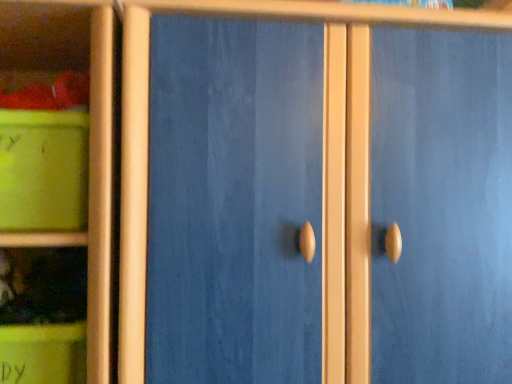
What do you see at coordinates (42, 170) in the screenshot? I see `matte green plastic container at left` at bounding box center [42, 170].

Locate an element on the screen. The height and width of the screenshot is (384, 512). matte green plastic container at left is located at coordinates (42, 170).

Measure the distance between point (56, 199) and camera.

They are 28.70 inches apart.

Identify the location of green matte container at lower left. (42, 315).

Describe the element at coordinates (42, 315) in the screenshot. I see `green matte container at lower left` at that location.

Identify the location of matte green plastic container at left. The image size is (512, 384). (42, 170).

Between green matte container at lower left and matte green plastic container at left, which one appears on the right side from the viewer's perspective?

From the viewer's perspective, green matte container at lower left appears more on the right side.

Considering the relative positions of green matte container at lower left and matte green plastic container at left in the image provided, is green matte container at lower left behind matte green plastic container at left?

That is True.

Considering the positions of points (26, 253) and (9, 197), is point (26, 253) farther from camera compared to point (9, 197)?

Yes, it is.

From the image's perspective, between green matte container at lower left and matte green plastic container at left, who is located below?

green matte container at lower left appears lower in the image.

From a real-world perspective, which is physically above, green matte container at lower left or matte green plastic container at left?

In real-world perspective, matte green plastic container at left is above.

Between green matte container at lower left and matte green plastic container at left, which one has smaller width?

Thinner between the two is green matte container at lower left.

Can you confirm if green matte container at lower left is taller than matte green plastic container at left?

Incorrect, the height of green matte container at lower left is not larger of that of matte green plastic container at left.

Does green matte container at lower left have a smaller size compared to matte green plastic container at left?

Yes.

Is green matte container at lower left positioned beyond the bounds of matte green plastic container at left?

green matte container at lower left is positioned outside matte green plastic container at left.

Can you see green matte container at lower left touching matte green plastic container at left?

green matte container at lower left and matte green plastic container at left are not in contact.

Is green matte container at lower left facing away from matte green plastic container at left?

No, green matte container at lower left is not facing the opposite direction of matte green plastic container at left.

Can you tell me how much green matte container at lower left and matte green plastic container at left differ in facing direction?

The angle between the facing direction of green matte container at lower left and the facing direction of matte green plastic container at left is 0.000727 degrees.

Locate an element on the screen. The height and width of the screenshot is (384, 512). cabinet below the matte green plastic container at left (from the image's perspective) is located at coordinates (42, 315).

Considering the relative positions of matte green plastic container at left and green matte container at lower left in the image provided, is matte green plastic container at left to the right of green matte container at lower left from the viewer's perspective?

Incorrect, matte green plastic container at left is not on the right side of green matte container at lower left.

Is matte green plastic container at left positioned behind green matte container at lower left?

No.

Is point (28, 187) closer to viewer compared to point (54, 337)?

That is True.

From the image's perspective, does matte green plastic container at left appear higher than green matte container at lower left?

Correct, matte green plastic container at left appears higher than green matte container at lower left in the image.

From a real-world perspective, is matte green plastic container at left under green matte container at lower left?

Actually, matte green plastic container at left is physically above green matte container at lower left in the real world.

Which object is thinner, matte green plastic container at left or green matte container at lower left?

Thinner between the two is green matte container at lower left.

Can you confirm if matte green plastic container at left is taller than green matte container at lower left?

Correct, matte green plastic container at left is much taller as green matte container at lower left.

Can you confirm if matte green plastic container at left is bigger than green matte container at lower left?

Correct, matte green plastic container at left is larger in size than green matte container at lower left.

Is matte green plastic container at left surrounding green matte container at lower left?

No, green matte container at lower left is not a part of matte green plastic container at left.

Is matte green plastic container at left next to green matte container at lower left and touching it?

No, matte green plastic container at left is not next to green matte container at lower left.

Based on the photo, is matte green plastic container at left looking in the opposite direction of green matte container at lower left?

matte green plastic container at left is not turned away from green matte container at lower left.

What's the angular difference between matte green plastic container at left and green matte container at lower left's facing directions?

matte green plastic container at left and green matte container at lower left are facing 0.000727 degrees away from each other.

Find the location of `storage box that is in front of the green matte container at lower left`. storage box that is in front of the green matte container at lower left is located at coordinates (42, 170).

At what (x,y) coordinates should I click in order to perform the action: click on cabinet below the matte green plastic container at left (from the image's perspective). Please return your answer as a coordinate pair (x, y). Image resolution: width=512 pixels, height=384 pixels. Looking at the image, I should click on (42, 315).

Identify the location of cabinet beneath the matte green plastic container at left (from a real-world perspective). The image size is (512, 384). (42, 315).